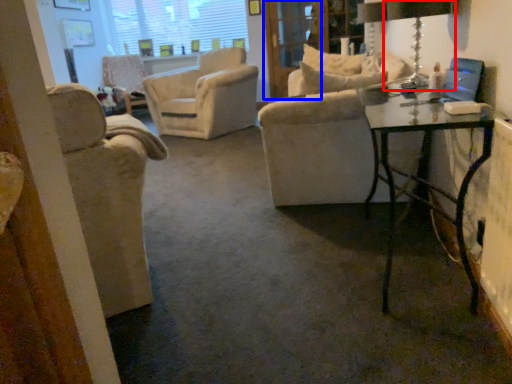
Question: Which object appears farthest to the camera in this image, table lamp (highlighted by a red box) or screen door (highlighted by a blue box)?

Choices:
 (A) table lamp
 (B) screen door

Answer: (B)